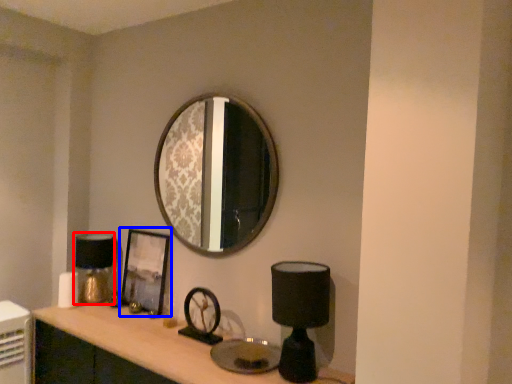
Question: Which of the following is the closest to the observer, table lamp (highlighted by a red box) or picture frame (highlighted by a blue box)?

Choices:
 (A) table lamp
 (B) picture frame

Answer: (B)